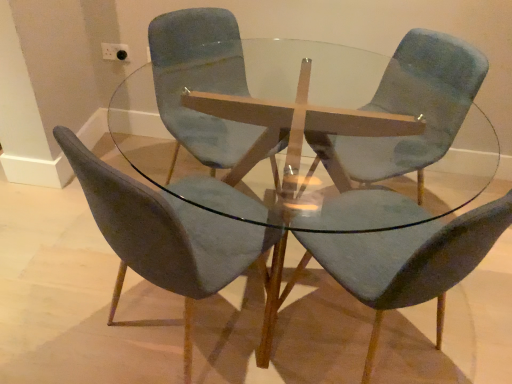
Question: Is velvet blue chair at center, which is counted as the 4th chair, starting from the right, behind velvet blue chair at center, which appears as the 3th chair when viewed from the right?

Choices:
 (A) no
 (B) yes

Answer: (A)

Question: Does velvet blue chair at center, the first chair positioned from the left, have a smaller size compared to velvet blue chair at center, which appears as the 3th chair when viewed from the right?

Choices:
 (A) yes
 (B) no

Answer: (B)

Question: Is velvet blue chair at center, which is counted as the 4th chair, starting from the right, outside of velvet blue chair at center, placed as the 2th chair when sorted from left to right?

Choices:
 (A) yes
 (B) no

Answer: (A)

Question: Is velvet blue chair at center, which is counted as the 4th chair, starting from the right, far from velvet blue chair at center, placed as the 2th chair when sorted from left to right?

Choices:
 (A) yes
 (B) no

Answer: (B)

Question: From a real-world perspective, is velvet blue chair at center, the first chair positioned from the left, on top of velvet blue chair at center, placed as the 2th chair when sorted from left to right?

Choices:
 (A) yes
 (B) no

Answer: (B)

Question: Considering the positions of point (183, 372) and point (324, 215), is point (183, 372) closer or farther from the camera than point (324, 215)?

Choices:
 (A) closer
 (B) farther

Answer: (B)

Question: Based on their sizes in the image, would you say velvet blue chair at center, which is counted as the 4th chair, starting from the right, is bigger or smaller than transparent glass table at center?

Choices:
 (A) small
 (B) big

Answer: (A)

Question: Considering their positions, is velvet blue chair at center, which is counted as the 4th chair, starting from the right, located in front of or behind transparent glass table at center?

Choices:
 (A) front
 (B) behind

Answer: (A)

Question: From the image's perspective, is velvet blue chair at center, the first chair positioned from the left, positioned above or below transparent glass table at center?

Choices:
 (A) below
 (B) above

Answer: (A)

Question: Is velvet blue chair at center, positioned as the first chair in right-to-left order, taller or shorter than velvet blue chair at center, which appears as the 3th chair when viewed from the right?

Choices:
 (A) short
 (B) tall

Answer: (A)

Question: In terms of width, does velvet blue chair at center, which is the fourth chair in left-to-right order, look wider or thinner when compared to velvet blue chair at center, which appears as the 3th chair when viewed from the right?

Choices:
 (A) thin
 (B) wide

Answer: (B)

Question: From the image's perspective, is velvet blue chair at center, which is the fourth chair in left-to-right order, above or below velvet blue chair at center, which appears as the 3th chair when viewed from the right?

Choices:
 (A) below
 (B) above

Answer: (A)

Question: Is velvet blue chair at center, which is the fourth chair in left-to-right order, inside the boundaries of velvet blue chair at center, placed as the 2th chair when sorted from left to right, or outside?

Choices:
 (A) outside
 (B) inside

Answer: (A)

Question: From a real-world perspective, is velvet blue chair at center, which is the fourth chair in left-to-right order, above or below transparent glass table at center?

Choices:
 (A) above
 (B) below

Answer: (A)

Question: Relative to transparent glass table at center, is velvet blue chair at center, positioned as the first chair in right-to-left order, in front or behind?

Choices:
 (A) front
 (B) behind

Answer: (B)